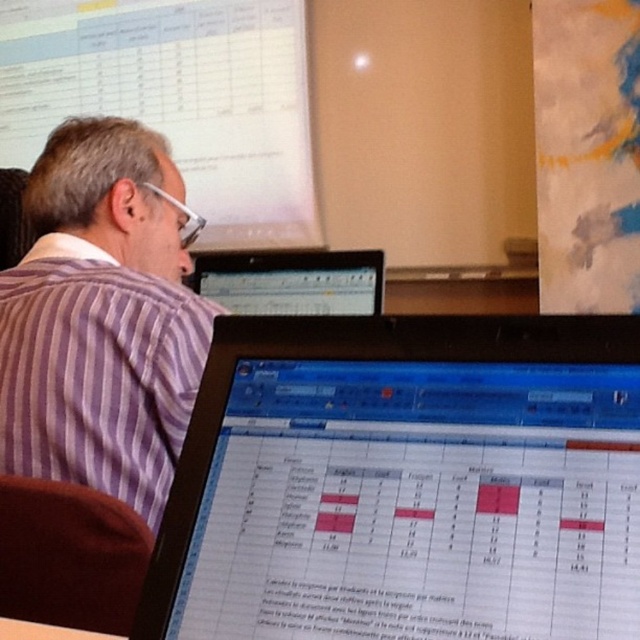
You are a tailor measuring the distance between the purple striped shirt at left and the brown fabric at lower left for a custom alteration. The minimum required space for your equipment is 10 inches. Can you proceed with the alterations?

The purple striped shirt at left and brown fabric at lower left are 9.94 inches apart, which is less than the required 10 inches. Therefore, the tailor cannot proceed with the alterations due to insufficient space.

You are a technician trying to adjust the position of the matte black monitor at center. According to the coordinates provided, where exactly is the matte black monitor positioned in the room?

The matte black monitor at center is located at point (404,483), which means it is positioned towards the upper right quadrant of the room based on the coordinate system provided.

You are trying to locate the matte black monitor at center and the matte black laptop at upper center in the image. According to their positions, which one is more to the right?

The matte black monitor at center is positioned on the right side of the matte black laptop at upper center, so it is more to the right.